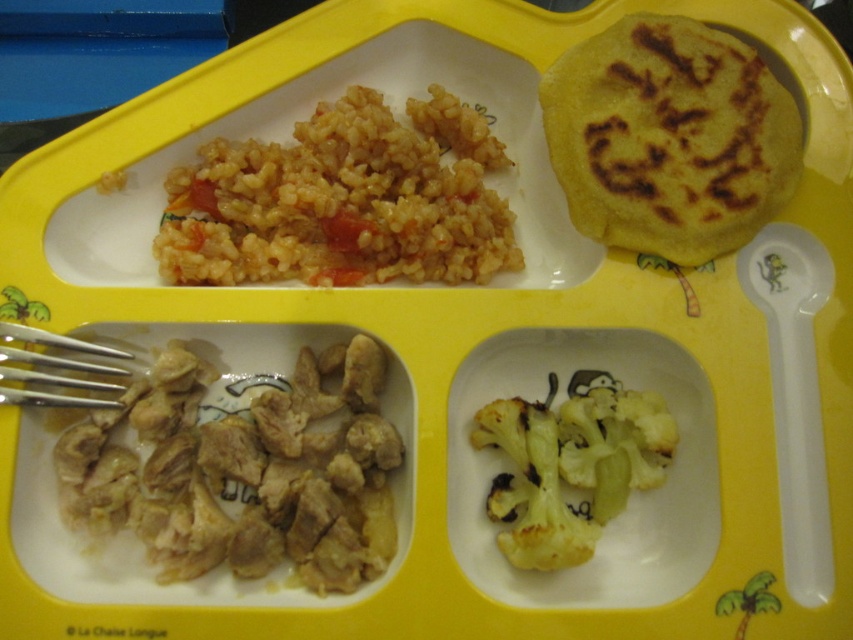
Which is more to the left, yellowish matte cauliflower at bottom right or yellow/green textured broccoli at bottom right?

yellowish matte cauliflower at bottom right is more to the left.

Is point (552, 426) closer to camera compared to point (585, 461)?

No, (552, 426) is further to viewer.

Is point (500, 410) positioned after point (624, 412)?

Yes, point (500, 410) is behind point (624, 412).

This screenshot has height=640, width=853. Identify the location of yellowish matte cauliflower at bottom right. (531, 488).

Who is higher up, golden brown rice at upper left or yellow/green textured broccoli at bottom right?

golden brown rice at upper left

Who is lower down, golden brown rice at upper left or yellow/green textured broccoli at bottom right?

yellow/green textured broccoli at bottom right is below.

Between point (465, 259) and point (561, 460), which one is positioned behind?

The point (465, 259) is more distant.

This screenshot has height=640, width=853. Find the location of `golden brown rice at upper left`. golden brown rice at upper left is located at coordinates (344, 202).

Which of these two, yellow/green textured broccoli at bottom right or silver metallic fork at lower left, stands taller?

yellow/green textured broccoli at bottom right

Is point (612, 394) in front of point (67, 346)?

No, (612, 394) is behind (67, 346).

This screenshot has height=640, width=853. Identify the location of yellow/green textured broccoli at bottom right. (614, 445).